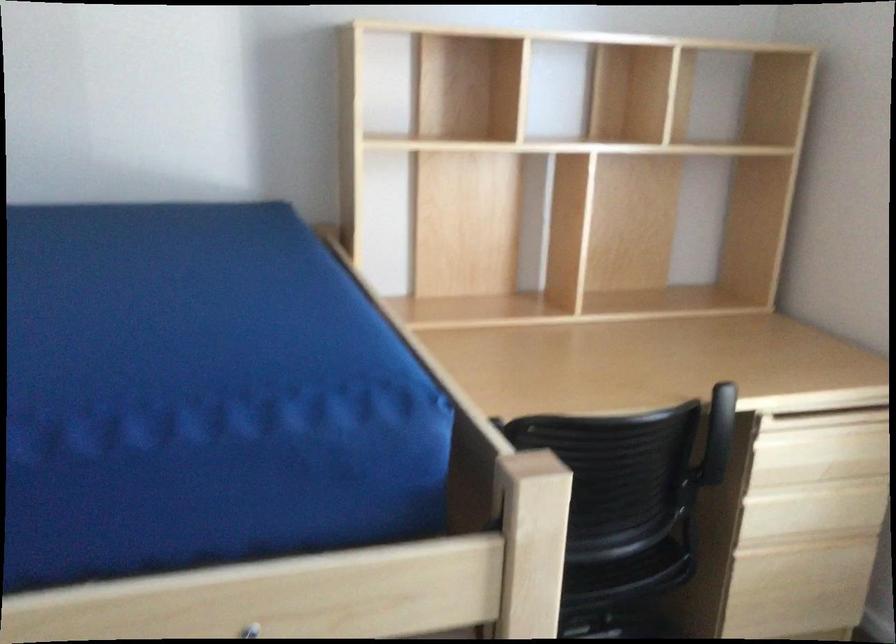
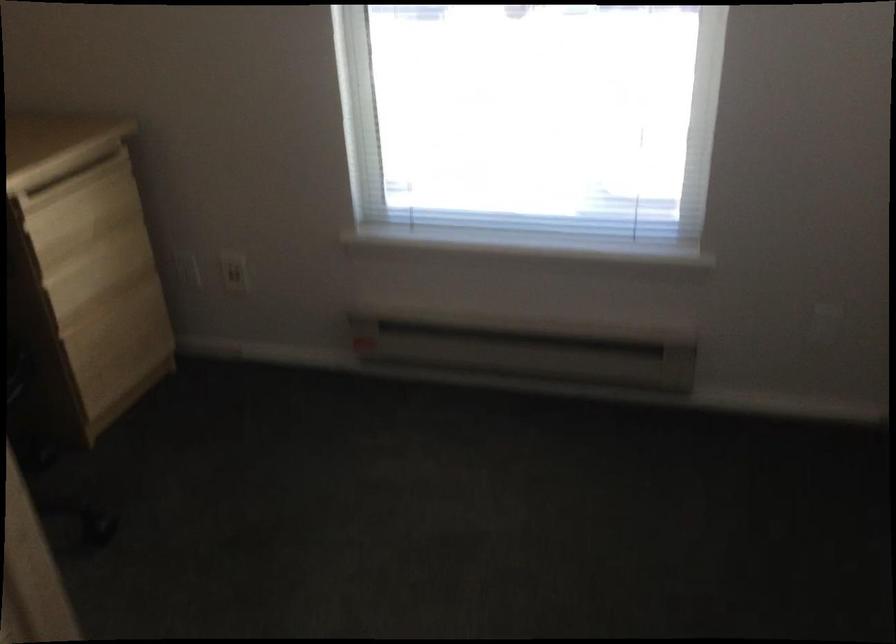
How did the camera likely rotate?

The rotation direction of the camera is right-down.